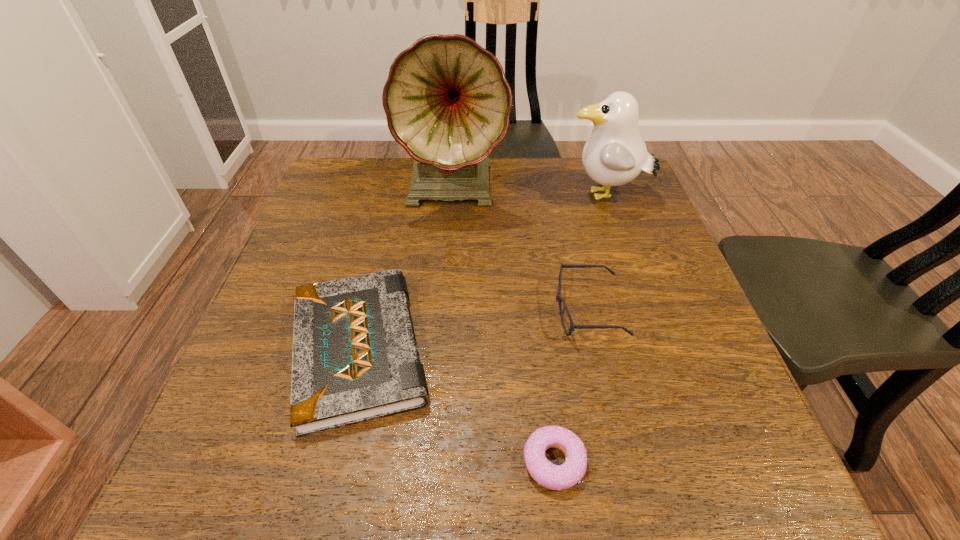
Identify the location of object situated at the far right corner. (615, 154).

This screenshot has height=540, width=960. In the image, there is a desktop. Find the location of `free space at the far edge`. free space at the far edge is located at coordinates coord(530,186).

The width and height of the screenshot is (960, 540). I want to click on free space at the near edge of the desktop, so click(330, 444).

Find the location of a particular element. The width and height of the screenshot is (960, 540). vacant region at the left edge of the desktop is located at coordinates (348, 241).

In the image, there is a desktop. Where is `free space at the right edge`? The width and height of the screenshot is (960, 540). free space at the right edge is located at coordinates 630,218.

What are the coordinates of `free location at the far left corner of the desktop` in the screenshot? It's located at (367, 196).

Identify the location of free space at the far right corner. This screenshot has width=960, height=540. (588, 177).

I want to click on blank region between the tallest object and the doughnut, so click(505, 325).

Identify the location of free space between the shortest object and the fourth shortest object. The image size is (960, 540). (580, 329).

At what (x,y) coordinates should I click in order to perform the action: click on vacant space that is in between the record player and the second tallest object. Please return your answer as a coordinate pair (x, y). The image size is (960, 540). Looking at the image, I should click on (530, 192).